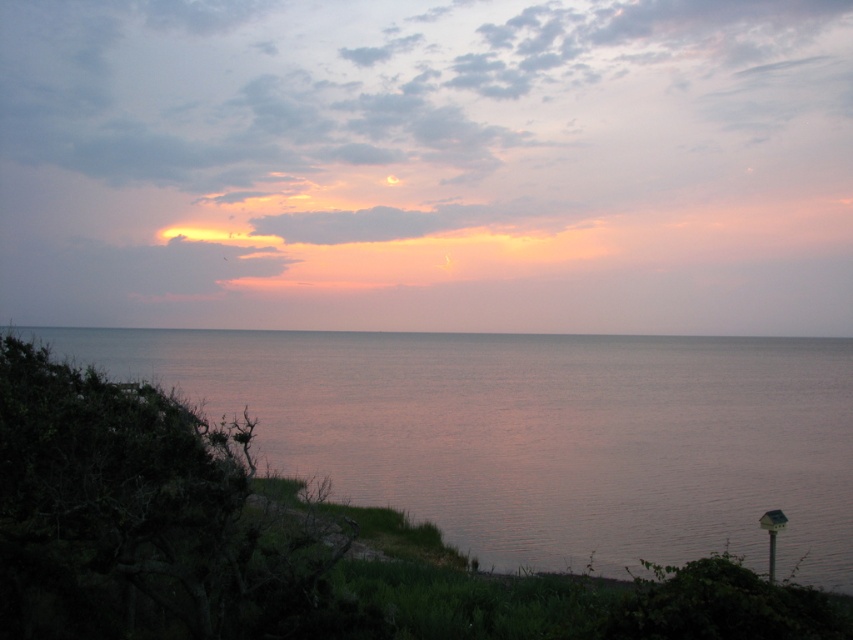
You are standing on a cliff overlooking the smooth water at lower left and the gray matte horizon at center. Which object appears bigger to you?

The smooth water at lower left appears bigger than the gray matte horizon at center because it has a larger size.

You are standing on a cliff overlooking the coastal scene. You want to take a photo that includes both the smooth water at lower left and the gray matte horizon at center. Which object should you adjust your camera to focus on first to ensure both are in the frame?

The smooth water at lower left is in front of the gray matte horizon at center, so you should focus on the smooth water at lower left first to ensure both are in the frame.